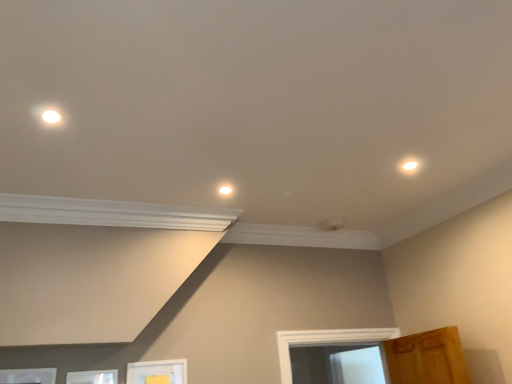
What do you see at coordinates (225, 189) in the screenshot? Image resolution: width=512 pixels, height=384 pixels. I see `white glossy light fixture at center, placed as the 2th dot when sorted from front to back` at bounding box center [225, 189].

Consider the image. How much space does white matte picture frame at lower left, acting as the 3th picture frame starting from the right, occupy horizontally?

white matte picture frame at lower left, acting as the 3th picture frame starting from the right, is 1.00 inches wide.

You are a GUI agent. You are given a task and a screenshot of the screen. Output one action in this format:
    pyautogui.click(x=<x>, y=<y>)
    Task: Click on the white glossy light fixture at upper right, the 1th dot viewed from the front
    This screenshot has width=512, height=384.
    Given the screenshot: What is the action you would take?
    pyautogui.click(x=409, y=166)

Where is `white matte picture frame at lower center, which appears as the 3th picture frame when viewed from the left`? white matte picture frame at lower center, which appears as the 3th picture frame when viewed from the left is located at coordinates click(x=157, y=372).

Does white matte picture frame at lower left, acting as the second picture frame starting from the left, have a greater height compared to white glossy light fixture at upper right, acting as the second dot starting from the left?

Indeed, white matte picture frame at lower left, acting as the second picture frame starting from the left, has a greater height compared to white glossy light fixture at upper right, acting as the second dot starting from the left.

Would you say white matte picture frame at lower left, arranged as the 2th picture frame when viewed from the right, is a long distance from white glossy light fixture at upper right, marked as the first dot in a top-to-bottom arrangement?

That's right, there is a large distance between white matte picture frame at lower left, arranged as the 2th picture frame when viewed from the right, and white glossy light fixture at upper right, marked as the first dot in a top-to-bottom arrangement.

Can you tell me how much white matte picture frame at lower left, acting as the second picture frame starting from the left, and white glossy light fixture at upper right, which ranks as the second dot in back-to-front order, differ in facing direction?

90 degrees separate the facing orientations of white matte picture frame at lower left, acting as the second picture frame starting from the left, and white glossy light fixture at upper right, which ranks as the second dot in back-to-front order.

In order to click on picture frame that is the 2nd object to the left of the white glossy light fixture at upper right, which is the 1th dot in right-to-left order, starting at the anchor in this screenshot , I will do `click(93, 377)`.

From a real-world perspective, who is located higher, white glossy light fixture at center, the first dot in the left-to-right sequence, or white matte picture frame at lower center, which appears as the 3th picture frame when viewed from the left?

white glossy light fixture at center, the first dot in the left-to-right sequence.

Consider the image. Is white glossy light fixture at center, the 1th dot when ordered from bottom to top, facing away from white matte picture frame at lower center, which appears as the 3th picture frame when viewed from the left?

No, white glossy light fixture at center, the 1th dot when ordered from bottom to top, is not facing the opposite direction of white matte picture frame at lower center, which appears as the 3th picture frame when viewed from the left.

Consider the image. Would you say white glossy light fixture at center, placed as the 2th dot when sorted from front to back, is outside white matte picture frame at lower center, the first picture frame viewed from the right?

Yes, white glossy light fixture at center, placed as the 2th dot when sorted from front to back, is not within white matte picture frame at lower center, the first picture frame viewed from the right.

Is white glossy light fixture at upper right, which ranks as the second dot in back-to-front order, turned away from white glossy light fixture at center, which is the 2th dot in right-to-left order?

white glossy light fixture at upper right, which ranks as the second dot in back-to-front order, is not turned away from white glossy light fixture at center, which is the 2th dot in right-to-left order.

Considering the sizes of objects white glossy light fixture at upper right, acting as the second dot starting from the left, and white glossy light fixture at center, the 2th dot from the top, in the image provided, who is smaller, white glossy light fixture at upper right, acting as the second dot starting from the left, or white glossy light fixture at center, the 2th dot from the top,?

With smaller size is white glossy light fixture at center, the 2th dot from the top.

From a real-world perspective, is white glossy light fixture at upper right, acting as the second dot starting from the left, located higher than white glossy light fixture at center, the first dot in the left-to-right sequence?

Incorrect, from a real-world perspective, white glossy light fixture at upper right, acting as the second dot starting from the left, is lower than white glossy light fixture at center, the first dot in the left-to-right sequence.

Is white matte picture frame at lower left, arranged as the 2th picture frame when viewed from the right, facing towards white matte picture frame at lower center, which appears as the 3th picture frame when viewed from the left?

No, white matte picture frame at lower left, arranged as the 2th picture frame when viewed from the right, is not facing towards white matte picture frame at lower center, which appears as the 3th picture frame when viewed from the left.

Would you say white matte picture frame at lower left, acting as the second picture frame starting from the left, is inside or outside white matte picture frame at lower center, which appears as the 3th picture frame when viewed from the left?

white matte picture frame at lower left, acting as the second picture frame starting from the left, is located beyond the bounds of white matte picture frame at lower center, which appears as the 3th picture frame when viewed from the left.

Does white matte picture frame at lower left, arranged as the 2th picture frame when viewed from the right, have a greater width compared to white matte picture frame at lower center, the first picture frame viewed from the right?

In fact, white matte picture frame at lower left, arranged as the 2th picture frame when viewed from the right, might be narrower than white matte picture frame at lower center, the first picture frame viewed from the right.

What are the coordinates of `the 3rd picture frame positioned below the white glossy light fixture at upper right, acting as the second dot starting from the left (from a real-world perspective)` in the screenshot? It's located at (93, 377).

Does point (415, 160) appear closer or farther from the camera than point (104, 374)?

Point (415, 160) appears to be closer to the viewer than point (104, 374).

Between white glossy light fixture at upper right, which appears as the 2th dot when ordered from the bottom, and white matte picture frame at lower left, acting as the second picture frame starting from the left, which one appears on the right side from the viewer's perspective?

white glossy light fixture at upper right, which appears as the 2th dot when ordered from the bottom.

Is there a large distance between white glossy light fixture at center, placed as the 2th dot when sorted from front to back, and white matte picture frame at lower left, arranged as the 2th picture frame when viewed from the right?

Absolutely, white glossy light fixture at center, placed as the 2th dot when sorted from front to back, is distant from white matte picture frame at lower left, arranged as the 2th picture frame when viewed from the right.

From the picture: Does white glossy light fixture at center, placed as the 2th dot when sorted from front to back, have a lesser width compared to white matte picture frame at lower left, arranged as the 2th picture frame when viewed from the right?

Incorrect, the width of white glossy light fixture at center, placed as the 2th dot when sorted from front to back, is not less than that of white matte picture frame at lower left, arranged as the 2th picture frame when viewed from the right.

Relative to white matte picture frame at lower left, acting as the second picture frame starting from the left, is white glossy light fixture at center, placed as the 2th dot when sorted from front to back, in front or behind?

Visually, white glossy light fixture at center, placed as the 2th dot when sorted from front to back, is located behind white matte picture frame at lower left, acting as the second picture frame starting from the left.

From the picture: Can you tell me how much white matte picture frame at lower left, acting as the 3th picture frame starting from the right, and white matte picture frame at lower center, which appears as the 3th picture frame when viewed from the left, differ in facing direction?

There is a 0.00213-degree angle between the facing directions of white matte picture frame at lower left, acting as the 3th picture frame starting from the right, and white matte picture frame at lower center, which appears as the 3th picture frame when viewed from the left.

Is white matte picture frame at lower left, acting as the 3th picture frame starting from the right, surrounding white matte picture frame at lower center, the first picture frame viewed from the right?

No, white matte picture frame at lower center, the first picture frame viewed from the right, is not a part of white matte picture frame at lower left, acting as the 3th picture frame starting from the right.

This screenshot has height=384, width=512. I want to click on picture frame that is the 2nd one when counting backward from the white matte picture frame at lower left, acting as the 3th picture frame starting from the right, so click(x=157, y=372).

From a real-world perspective, which object rests below the other?

white matte picture frame at lower center, the first picture frame viewed from the right, from a real-world perspective.

At what (x,y) coordinates should I click in order to perform the action: click on the 1st picture frame in front of the white glossy light fixture at upper right, the 1th dot viewed from the front, counting from the anchor's position. Please return your answer as a coordinate pair (x, y). The width and height of the screenshot is (512, 384). Looking at the image, I should click on (93, 377).

Starting from the white matte picture frame at lower center, which appears as the 3th picture frame when viewed from the left, which dot is the 1st one to the right? Please provide its 2D coordinates.

[(225, 189)]

From the image, which object appears to be nearer to white matte picture frame at lower left, acting as the 3th picture frame starting from the right, white matte picture frame at lower left, arranged as the 2th picture frame when viewed from the right, or white glossy light fixture at center, placed as the 2th dot when sorted from front to back?

Based on the image, white matte picture frame at lower left, arranged as the 2th picture frame when viewed from the right, appears to be nearer to white matte picture frame at lower left, acting as the 3th picture frame starting from the right.

When comparing their distances from white matte picture frame at lower center, the first picture frame viewed from the right, does white glossy light fixture at center, the first dot in the left-to-right sequence, or white glossy light fixture at upper right, the 1th dot viewed from the front, seem further?

Among the two, white glossy light fixture at upper right, the 1th dot viewed from the front, is located further to white matte picture frame at lower center, the first picture frame viewed from the right.

When comparing their distances from white glossy light fixture at center, the first dot in the left-to-right sequence, does white matte picture frame at lower center, which appears as the 3th picture frame when viewed from the left, or white glossy light fixture at upper right, which is the 1th dot in right-to-left order, seem further?

Among the two, white matte picture frame at lower center, which appears as the 3th picture frame when viewed from the left, is located further to white glossy light fixture at center, the first dot in the left-to-right sequence.

Estimate the real-world distances between objects in this image. Which object is further from white glossy light fixture at upper right, which ranks as the second dot in back-to-front order, white matte picture frame at lower left, acting as the 3th picture frame starting from the right, or white matte picture frame at lower center, which appears as the 3th picture frame when viewed from the left?

white matte picture frame at lower left, acting as the 3th picture frame starting from the right, lies further to white glossy light fixture at upper right, which ranks as the second dot in back-to-front order, than the other object.

Which object lies further to the anchor point white glossy light fixture at upper right, which appears as the 2th dot when ordered from the bottom, white matte picture frame at lower center, the first picture frame viewed from the right, or white glossy light fixture at center, acting as the first dot starting from the back?

The object further to white glossy light fixture at upper right, which appears as the 2th dot when ordered from the bottom, is white matte picture frame at lower center, the first picture frame viewed from the right.

From the image, which object appears to be nearer to white glossy light fixture at center, which is the 2th dot in right-to-left order, white matte picture frame at lower left, the 1th picture frame when ordered from left to right, or white matte picture frame at lower left, arranged as the 2th picture frame when viewed from the right?

white matte picture frame at lower left, arranged as the 2th picture frame when viewed from the right.

In the scene shown: Based on their spatial positions, is white matte picture frame at lower left, arranged as the 2th picture frame when viewed from the right, or white matte picture frame at lower left, acting as the 3th picture frame starting from the right, further from white glossy light fixture at center, which is the 2th dot in right-to-left order?

Based on the image, white matte picture frame at lower left, acting as the 3th picture frame starting from the right, appears to be further to white glossy light fixture at center, which is the 2th dot in right-to-left order.

Based on their spatial positions, is white glossy light fixture at center, which is the 2th dot in right-to-left order, or white glossy light fixture at upper right, which ranks as the second dot in back-to-front order, further from white matte picture frame at lower left, acting as the second picture frame starting from the left?

Based on the image, white glossy light fixture at upper right, which ranks as the second dot in back-to-front order, appears to be further to white matte picture frame at lower left, acting as the second picture frame starting from the left.

At what (x,y) coordinates should I click in order to perform the action: click on dot between white matte picture frame at lower left, the 1th picture frame when ordered from left to right, and white glossy light fixture at upper right, the 1th dot viewed from the front, in the horizontal direction. Please return your answer as a coordinate pair (x, y). The image size is (512, 384). Looking at the image, I should click on (225, 189).

Identify the location of dot located between white matte picture frame at lower center, the first picture frame viewed from the right, and white glossy light fixture at upper right, the 1th dot viewed from the front, in the left-right direction. click(225, 189).

Locate an element on the screen. The height and width of the screenshot is (384, 512). picture frame between white matte picture frame at lower left, the 1th picture frame when ordered from left to right, and white matte picture frame at lower center, the first picture frame viewed from the right, from left to right is located at coordinates (93, 377).

I want to click on dot between white matte picture frame at lower left, arranged as the 2th picture frame when viewed from the right, and white glossy light fixture at upper right, which is the 1th dot in right-to-left order, so click(x=225, y=189).